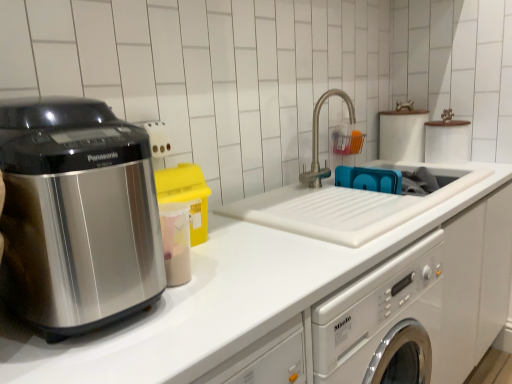
This screenshot has height=384, width=512. Identify the location of spots to the right of satin metallic appliance at left. (224, 294).